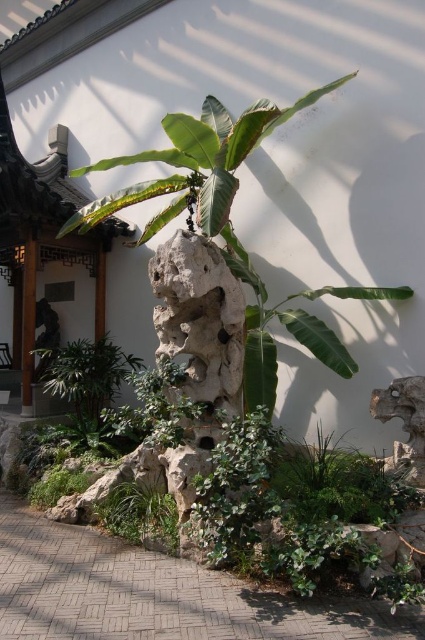
You are a gardener planning to place a new small statue between the green leafy plant at center and the green leafy plant at lower center. Based on their widths, which plant should the statue be placed closer to for balance?

The green leafy plant at center might be wider than the green leafy plant at lower center, so placing the statue closer to the smaller plant at lower center would help achieve balance between them.

You are standing at the entrance of the garden and want to walk towards the green leafy plant at center. Which direction should you move relative to the paved brick path at lower center?

You should move to the right of the paved brick path at lower center to reach the green leafy plant at center because the paved brick path at lower center is to the left of green leafy plant at center.